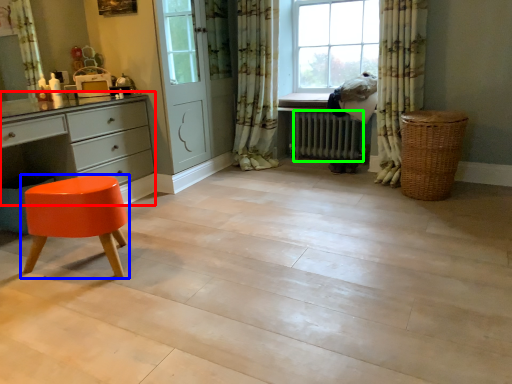
Question: Estimate the real-world distances between objects in this image. Which object is farther from chest of drawers (highlighted by a red box), stool (highlighted by a blue box) or radiator (highlighted by a green box)?

Choices:
 (A) stool
 (B) radiator

Answer: (B)